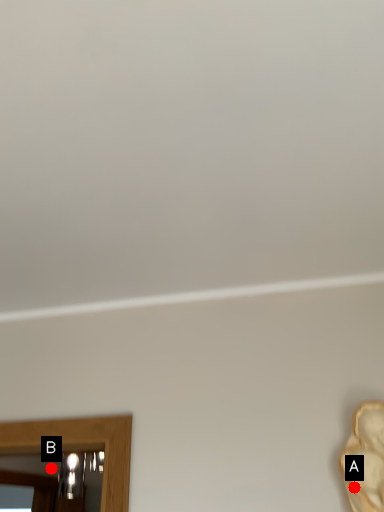
Question: Two points are circled on the image, labeled by A and B beside each circle. Which of the following is the closest to the observer?

Choices:
 (A) A is closer
 (B) B is closer

Answer: (A)